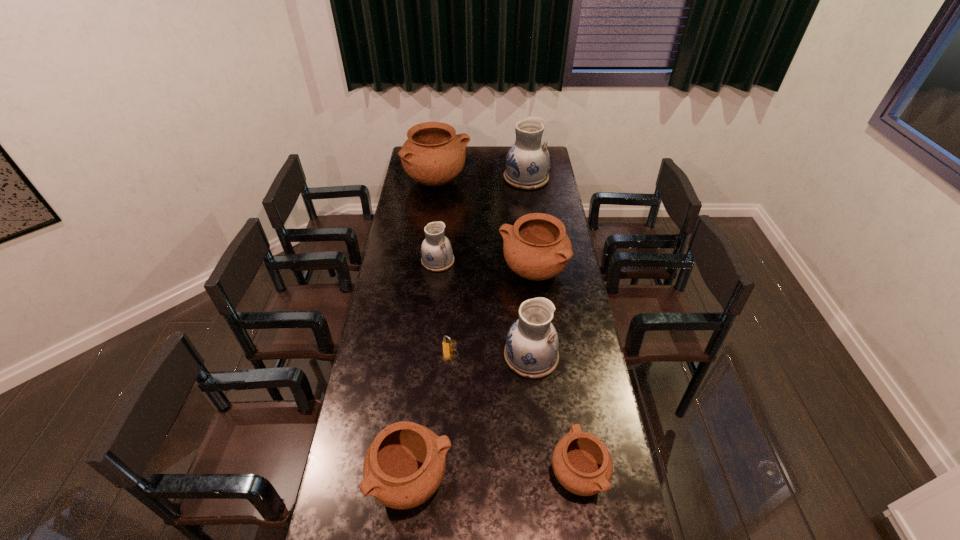
Locate an element on the screen. This screenshot has width=960, height=540. object that is at the far right corner is located at coordinates (527, 163).

Where is `free space at the left edge of the desktop`? This screenshot has height=540, width=960. free space at the left edge of the desktop is located at coordinates (392, 418).

In the image, there is a desktop. Where is `vacant space at the right edge`? This screenshot has width=960, height=540. vacant space at the right edge is located at coordinates (562, 383).

The image size is (960, 540). What are the coordinates of `vacant point located between the second smallest blue pottery and the padlock` in the screenshot? It's located at (491, 353).

Where is `free space between the third biggest terracotta pottery and the shortest pottery`? This screenshot has width=960, height=540. free space between the third biggest terracotta pottery and the shortest pottery is located at coordinates (494, 476).

At what (x,y) coordinates should I click in order to perform the action: click on blank region between the second farthest terracotta pottery and the biggest terracotta pottery. Please return your answer as a coordinate pair (x, y). This screenshot has height=540, width=960. Looking at the image, I should click on (485, 226).

Find the location of a particular element. The width and height of the screenshot is (960, 540). empty location between the shortest pottery and the second smallest terracotta pottery is located at coordinates (494, 476).

Find the location of a particular element. This screenshot has height=540, width=960. vacant area that lies between the farthest terracotta pottery and the nearest blue pottery is located at coordinates (485, 268).

The image size is (960, 540). I want to click on free spot between the third biggest terracotta pottery and the leftmost blue pottery, so click(425, 370).

Locate an element on the screen. unoccupied area between the nearest blue pottery and the smallest blue pottery is located at coordinates (485, 308).